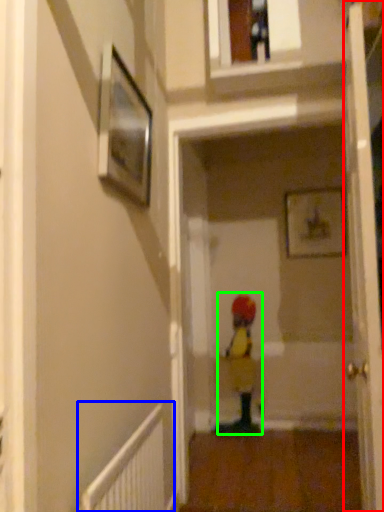
Question: Based on their relative distances, which object is farther from door (highlighted by a red box)? Choose from radiator (highlighted by a blue box) and toddler (highlighted by a green box).

Choices:
 (A) radiator
 (B) toddler

Answer: (B)